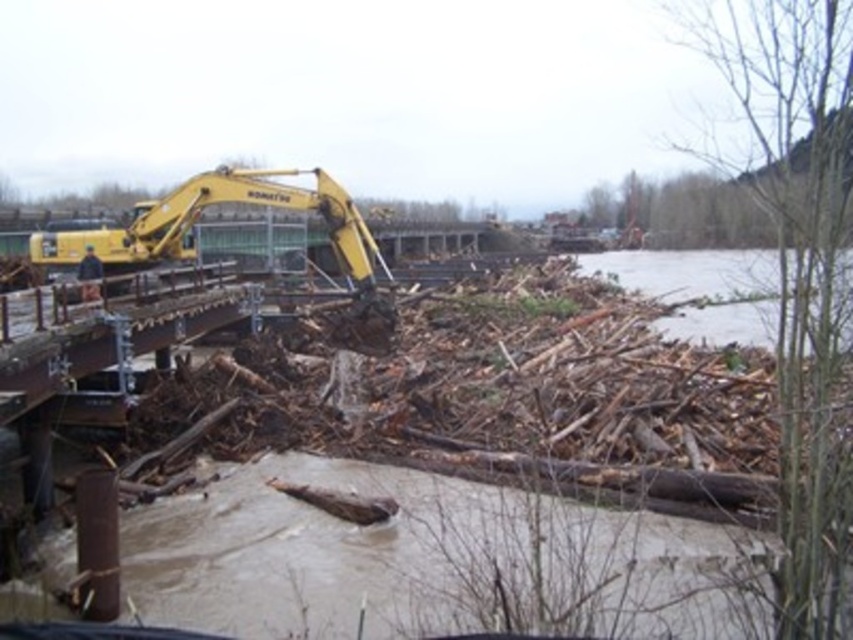
Is yellow rubber excavator at upper left positioned behind brown muddy water at lower right?

That is False.

Who is more forward, [265,358] or [625,253]?

Point [265,358] is in front.

Where is `yellow rubber excavator at upper left`? The image size is (853, 640). yellow rubber excavator at upper left is located at coordinates (503, 401).

Can you confirm if yellow metallic excavator at upper left is positioned to the left of brown muddy water at lower right?

Correct, you'll find yellow metallic excavator at upper left to the left of brown muddy water at lower right.

Does yellow metallic excavator at upper left have a larger size compared to brown muddy water at lower right?

Actually, yellow metallic excavator at upper left might be smaller than brown muddy water at lower right.

This screenshot has height=640, width=853. I want to click on yellow metallic excavator at upper left, so click(x=248, y=204).

Does yellow rubber excavator at upper left have a larger size compared to yellow metallic excavator at upper left?

Indeed, yellow rubber excavator at upper left has a larger size compared to yellow metallic excavator at upper left.

This screenshot has width=853, height=640. I want to click on yellow rubber excavator at upper left, so click(503, 401).

Who is more distant from viewer, (300, 333) or (148, 250)?

Positioned behind is point (300, 333).

I want to click on yellow rubber excavator at upper left, so click(x=503, y=401).